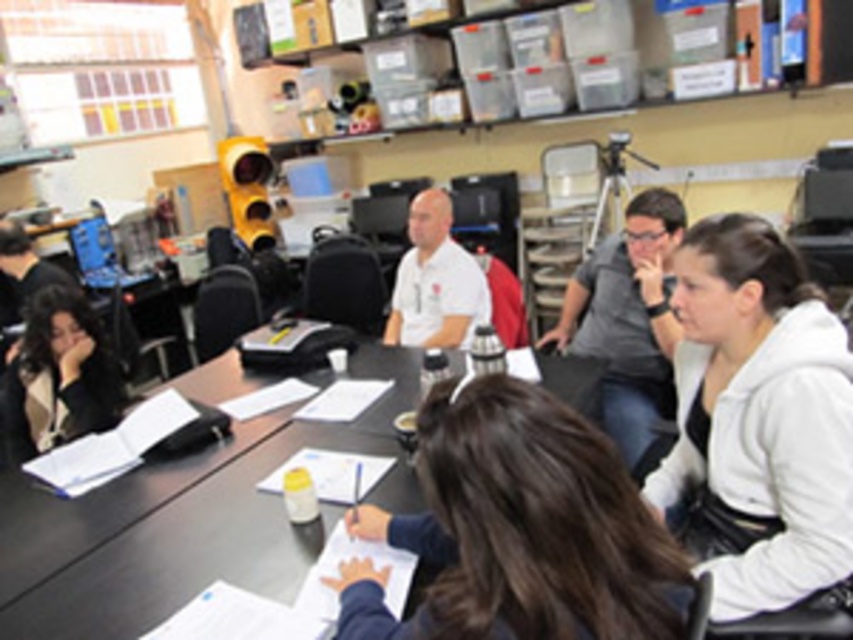
You are standing at the end of the long table and want to reach both the point at coordinates point (587,481) and point (648,202). Which point will you reach first?

The point at coordinates point (587,481) is closer to the viewer than point (648,202), so you will reach point (587,481) first.

You are a photographer standing at the back of the room and want to take a photo of the beige textured jacket at lower left and the white matte shirt at center. Which one is more to the left side of the frame?

The beige textured jacket at lower left is more to the left side of the frame.

You are standing at the end of the long table and want to place a small object between the beige textured jacket at lower left and the white matte shirt at center. Based on their heights, which one is shorter and would allow the object to be placed closer to the table surface?

The beige textured jacket at lower left is shorter than the white matte shirt at center, so placing the object closer to the table surface would be possible near the beige textured jacket at lower left.